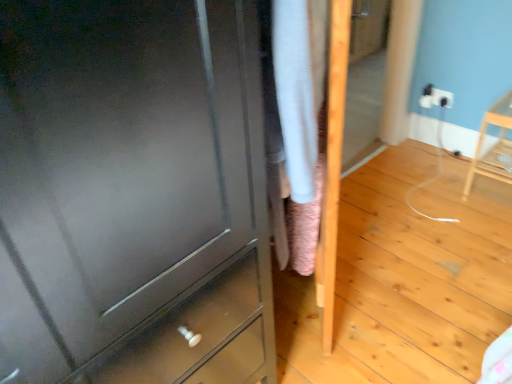
Question: Is light wood chair at right to the left or to the right of matte gray chest of drawers at center in the image?

Choices:
 (A) right
 (B) left

Answer: (A)

Question: From a real-world perspective, relative to matte gray chest of drawers at center, is light wood chair at right vertically above or below?

Choices:
 (A) below
 (B) above

Answer: (A)

Question: Estimate the real-world distances between objects in this image. Which object is closer to the matte gray chest of drawers at center?

Choices:
 (A) white plastic electric outlet at upper right
 (B) light wood chair at right

Answer: (B)

Question: Based on their relative distances, which object is nearer to the light wood chair at right?

Choices:
 (A) matte gray chest of drawers at center
 (B) white plastic electric outlet at upper right

Answer: (B)